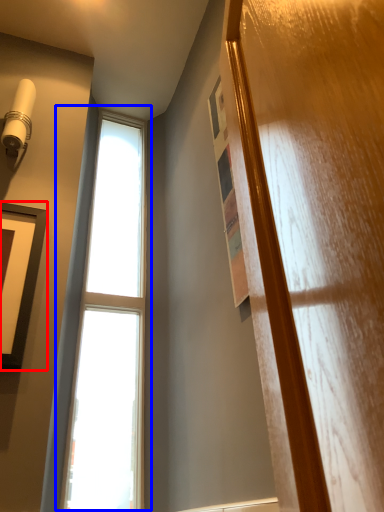
Question: Which of the following is the farthest to the observer, picture frame (highlighted by a red box) or window (highlighted by a blue box)?

Choices:
 (A) picture frame
 (B) window

Answer: (B)